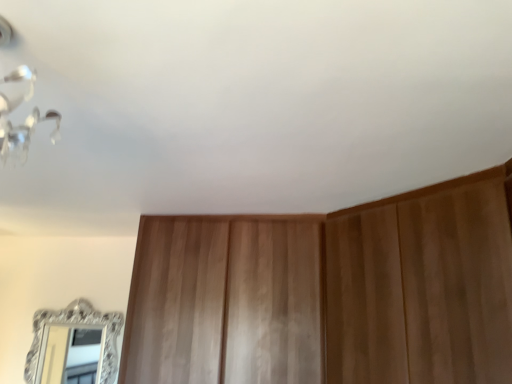
Locate an element on the screen. The width and height of the screenshot is (512, 384). wooden dresser at center is located at coordinates (328, 293).

What do you see at coordinates (328, 293) in the screenshot? I see `wooden dresser at center` at bounding box center [328, 293].

Where is `silver ornate mirror at lower left`? silver ornate mirror at lower left is located at coordinates (67, 342).

This screenshot has height=384, width=512. Describe the element at coordinates (67, 342) in the screenshot. I see `silver ornate mirror at lower left` at that location.

Image resolution: width=512 pixels, height=384 pixels. Find the location of `wooden dresser at center`. wooden dresser at center is located at coordinates (328, 293).

Can you confirm if silver ornate mirror at lower left is positioned to the right of wooden dresser at center?

In fact, silver ornate mirror at lower left is to the left of wooden dresser at center.

Between silver ornate mirror at lower left and wooden dresser at center, which one is positioned in front?

wooden dresser at center.

Is point (116, 346) farther from camera compared to point (313, 260)?

Yes, it is.

From the image's perspective, does silver ornate mirror at lower left appear lower than wooden dresser at center?

Indeed, from the image's perspective, silver ornate mirror at lower left is shown beneath wooden dresser at center.

From a real-world perspective, is silver ornate mirror at lower left located higher than wooden dresser at center?

Actually, silver ornate mirror at lower left is physically below wooden dresser at center in the real world.

Looking at their sizes, would you say silver ornate mirror at lower left is wider or thinner than wooden dresser at center?

Considering their sizes, silver ornate mirror at lower left looks slimmer than wooden dresser at center.

Considering the sizes of silver ornate mirror at lower left and wooden dresser at center in the image, is silver ornate mirror at lower left taller or shorter than wooden dresser at center?

silver ornate mirror at lower left is shorter than wooden dresser at center.

Considering the sizes of objects silver ornate mirror at lower left and wooden dresser at center in the image provided, who is bigger, silver ornate mirror at lower left or wooden dresser at center?

Bigger between the two is wooden dresser at center.

Is silver ornate mirror at lower left located outside wooden dresser at center?

Yes, silver ornate mirror at lower left is located beyond the bounds of wooden dresser at center.

Is silver ornate mirror at lower left with wooden dresser at center?

silver ornate mirror at lower left and wooden dresser at center are clearly separated.

Is silver ornate mirror at lower left aimed at wooden dresser at center?

No, silver ornate mirror at lower left is not oriented towards wooden dresser at center.

Consider the image. Can you tell me how much silver ornate mirror at lower left and wooden dresser at center differ in facing direction?

silver ornate mirror at lower left and wooden dresser at center are facing 0.977 degrees away from each other.

This screenshot has width=512, height=384. In the image, there is a wooden dresser at center. Identify the location of mirror below it (from the image's perspective). (67, 342).

Based on their positions, is wooden dresser at center located to the left or right of silver ornate mirror at lower left?

From the image, it's evident that wooden dresser at center is to the right of silver ornate mirror at lower left.

Between wooden dresser at center and silver ornate mirror at lower left, which one is positioned in front?

Positioned in front is wooden dresser at center.

Is point (408, 367) behind point (55, 353)?

That is False.

Looking at this image, from the image's perspective, who appears lower, wooden dresser at center or silver ornate mirror at lower left?

silver ornate mirror at lower left.

From a real-world perspective, between wooden dresser at center and silver ornate mirror at lower left, who is vertically lower?

silver ornate mirror at lower left.

Considering the relative sizes of wooden dresser at center and silver ornate mirror at lower left in the image provided, is wooden dresser at center thinner than silver ornate mirror at lower left?

In fact, wooden dresser at center might be wider than silver ornate mirror at lower left.

Does wooden dresser at center have a lesser height compared to silver ornate mirror at lower left?

No, wooden dresser at center is not shorter than silver ornate mirror at lower left.

From the picture: Which of these two, wooden dresser at center or silver ornate mirror at lower left, is bigger?

Bigger between the two is wooden dresser at center.

Is wooden dresser at center positioned beyond the bounds of silver ornate mirror at lower left?

Indeed, wooden dresser at center is completely outside silver ornate mirror at lower left.

Is wooden dresser at center positioned far away from silver ornate mirror at lower left?

wooden dresser at center is positioned a significant distance from silver ornate mirror at lower left.

Could you tell me if wooden dresser at center is facing silver ornate mirror at lower left?

No, wooden dresser at center is not facing towards silver ornate mirror at lower left.

Image resolution: width=512 pixels, height=384 pixels. I want to click on mirror behind the wooden dresser at center, so click(x=67, y=342).

Locate an element on the screen. Image resolution: width=512 pixels, height=384 pixels. mirror on the left of wooden dresser at center is located at coordinates (67, 342).

Locate an element on the screen. This screenshot has width=512, height=384. dresser that is above the silver ornate mirror at lower left (from a real-world perspective) is located at coordinates (328, 293).